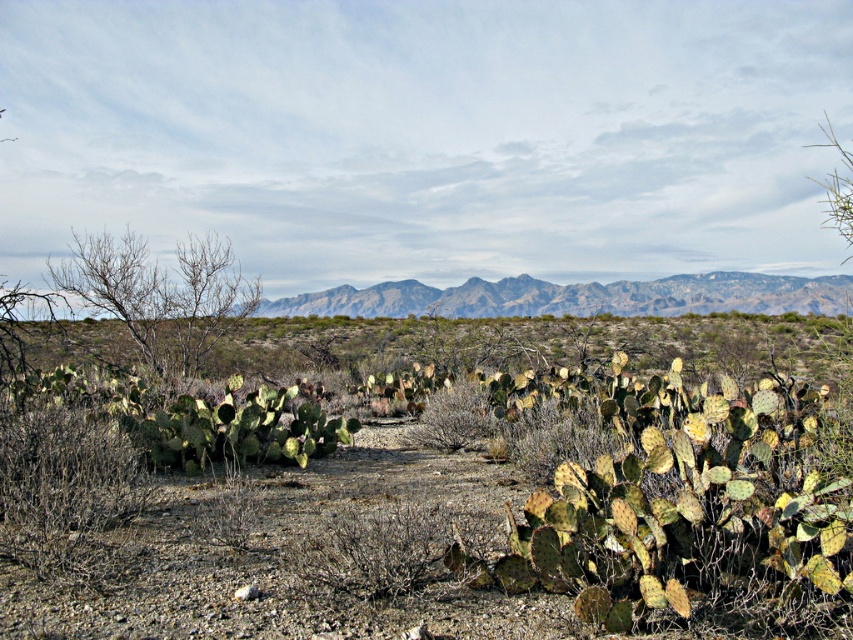
You are a hiker trying to navigate the desert. You see the green spiny cactus at center and the gray rocky mountains at center. Which object is positioned to the left when viewed from your perspective?

The green spiny cactus at center is to the left of the gray rocky mountains at center, so the green spiny cactus at center is positioned to the left.

You are an explorer in the desert and see the green spiny cactus at center and the gray rocky mountains at center. Which object is closer to the ground?

The green spiny cactus at center is closer to the ground because it is located below the gray rocky mountains at center.